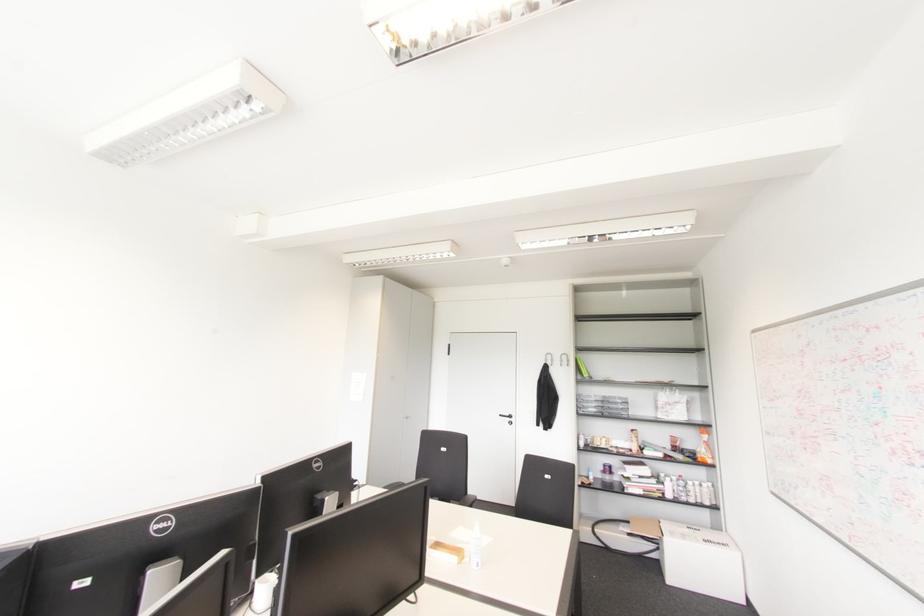
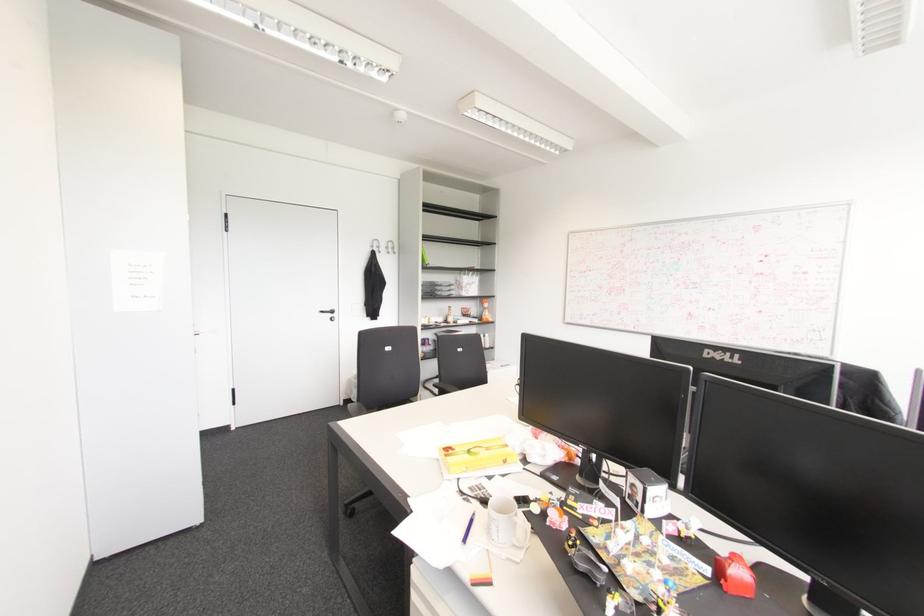
Locate, in the second image, the point that corresponds to pixel 566 360 in the first image.

(392, 248)